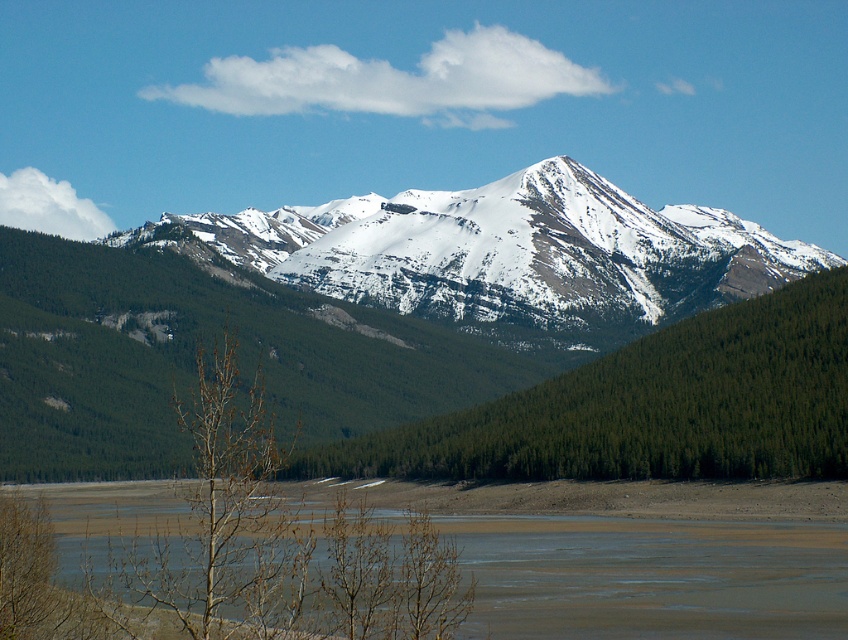
You are a hiker planning to cross the brown sandy river at lower center. From your current position at the leafless tree branches in the bottom left corner, which direction should you go to reach the river without passing through the snowy rocky mountain at center?

To reach the brown sandy river at lower center from the leafless tree branches in the bottom left corner without passing through the snowy rocky mountain at center, you should move towards the right. The brown sandy river at lower center is positioned behind the mountain, so moving right would allow you to bypass the mountain and reach the river.